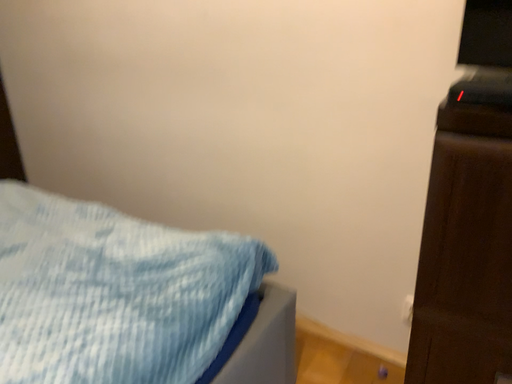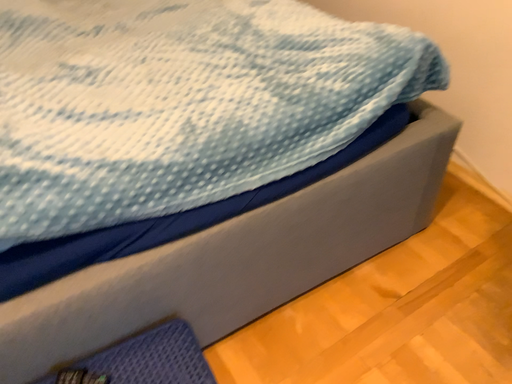
Question: Which way did the camera rotate in the video?

Choices:
 (A) rotated right
 (B) rotated left

Answer: (B)